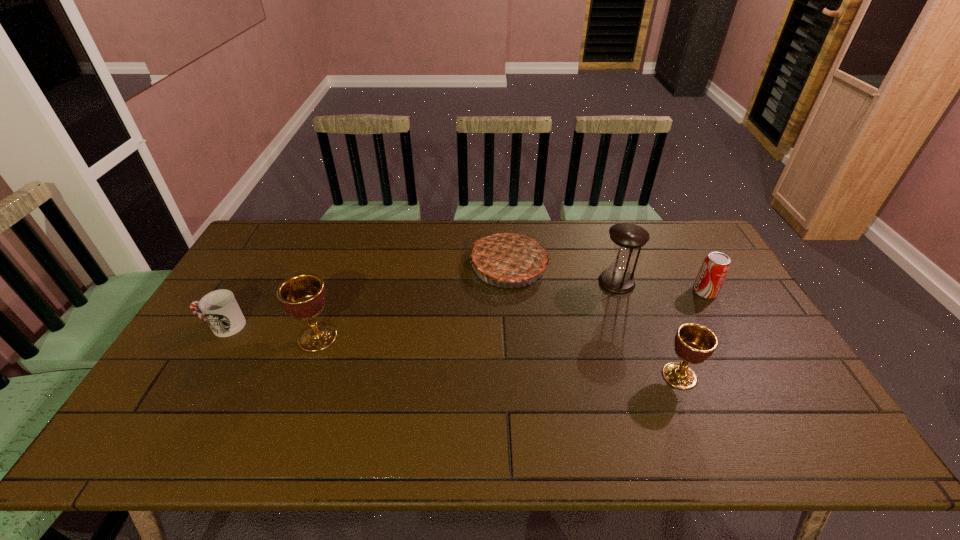
At what (x,y) coordinates should I click in order to perform the action: click on the taller chalice. Please return your answer as a coordinate pair (x, y). Looking at the image, I should click on click(x=303, y=296).

Identify the location of the farther chalice. (303, 296).

I want to click on the nearer chalice, so click(x=694, y=343).

This screenshot has height=540, width=960. Identify the location of the nearest object. (694, 343).

Where is `soda can`? The image size is (960, 540). soda can is located at coordinates tap(715, 267).

Identify the location of pie. The height and width of the screenshot is (540, 960). (508, 257).

This screenshot has height=540, width=960. I want to click on the leftmost object, so click(219, 308).

In order to click on the shortest object in this screenshot , I will do `click(219, 308)`.

Find the location of `hourglass`. hourglass is located at coordinates (627, 237).

Identify the location of free space located 0.170m on the left of the second object from left to right. This screenshot has height=540, width=960. [x=236, y=338].